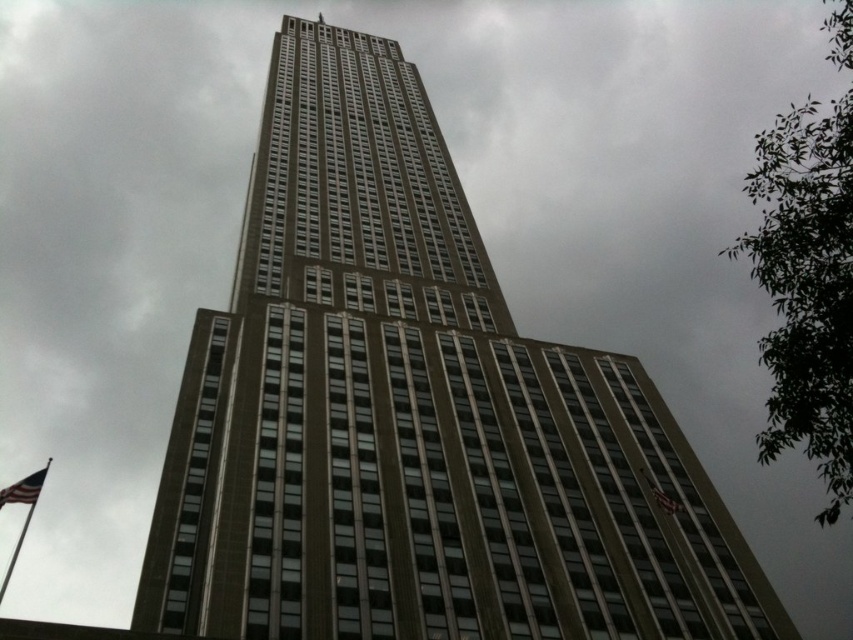
Question: Can you confirm if metallic flag pole at lower left is positioned above american flag at lower left?

Choices:
 (A) no
 (B) yes

Answer: (A)

Question: Is metallic flag pole at lower left below american flag at lower left?

Choices:
 (A) no
 (B) yes

Answer: (B)

Question: Considering the relative positions of metallic flag pole at lower left and american flag at lower left in the image provided, where is metallic flag pole at lower left located with respect to american flag at lower left?

Choices:
 (A) above
 (B) below

Answer: (B)

Question: Which of the following is the closest to the observer?

Choices:
 (A) metallic flag pole at lower left
 (B) american flag at lower left

Answer: (B)